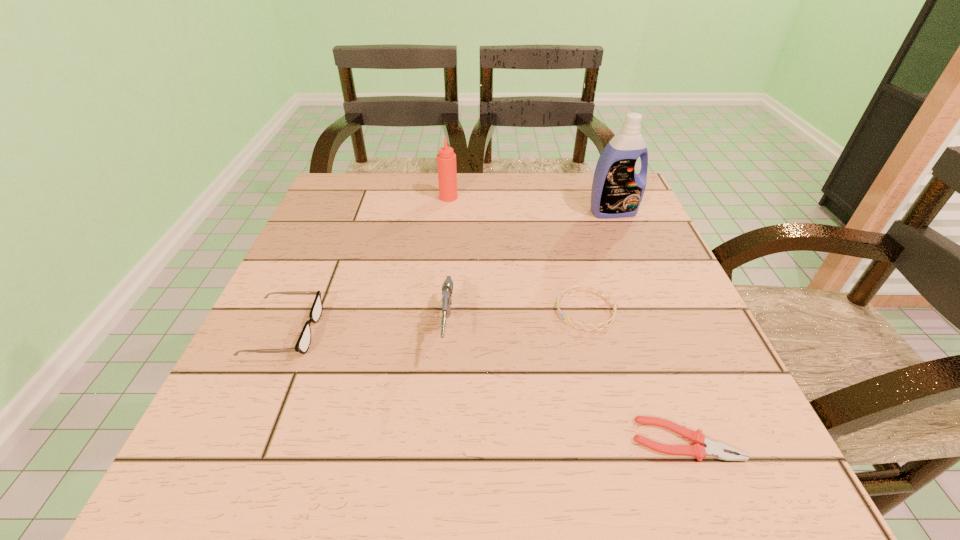
Where is `free spot between the pliers and the gun`? free spot between the pliers and the gun is located at coordinates (566, 386).

The width and height of the screenshot is (960, 540). Identify the location of empty space between the Tabasco sauce and the spectacles. (367, 265).

This screenshot has width=960, height=540. I want to click on empty location between the fourth shortest object and the third shortest object, so click(367, 332).

Identify which object is the fourth nearest to the tallest object. Please provide its 2D coordinates. Your answer should be formatted as a tuple, i.e. [(x, y)], where the tuple contains the x and y coordinates of a point satisfying the conditions above.

[(716, 449)]

Locate which object ranks in proximity to the Tabasco sauce. Please provide its 2D coordinates. Your answer should be formatted as a tuple, i.e. [(x, y)], where the tuple contains the x and y coordinates of a point satisfying the conditions above.

[(617, 191)]

Find the location of a particular element. vacant region that satisfies the following two spatial constraints: 1. at the barrel of the gun; 2. on the right side of the shortest object is located at coordinates (440, 440).

This screenshot has height=540, width=960. In order to click on vacant space that satisfies the following two spatial constraints: 1. on the front-facing side of the nearest object; 2. on the right side of the leftmost object in this screenshot , I will do `click(236, 440)`.

Find the location of a particular element. The width and height of the screenshot is (960, 540). blank space that satisfies the following two spatial constraints: 1. at the barrel of the gun; 2. on the right side of the pliers is located at coordinates (440, 440).

Where is `blank area in the image that satisfies the following two spatial constraints: 1. on the surface of the fifth tallest object showing star-shaped elements; 2. at the barrel of the fourth shortest object`? This screenshot has width=960, height=540. blank area in the image that satisfies the following two spatial constraints: 1. on the surface of the fifth tallest object showing star-shaped elements; 2. at the barrel of the fourth shortest object is located at coordinates (591, 332).

Find the location of a particular element. vacant space that satisfies the following two spatial constraints: 1. on the surface of the second shortest object showing star-shaped elements; 2. at the barrel of the fourth shortest object is located at coordinates (591, 332).